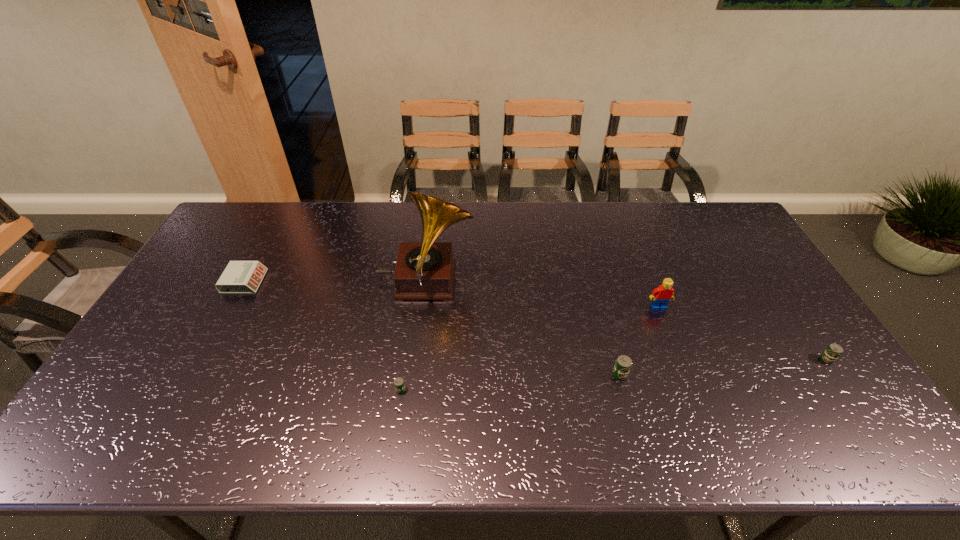
Given the evenly spaced beer cans in the image, where should an extra beer can be added on the left to preserve the spacing? Please point to a vacant space. Please provide its 2D coordinates. Your answer should be formatted as a tuple, i.e. [(x, y)], where the tuple contains the x and y coordinates of a point satisfying the conditions above.

[(168, 407)]